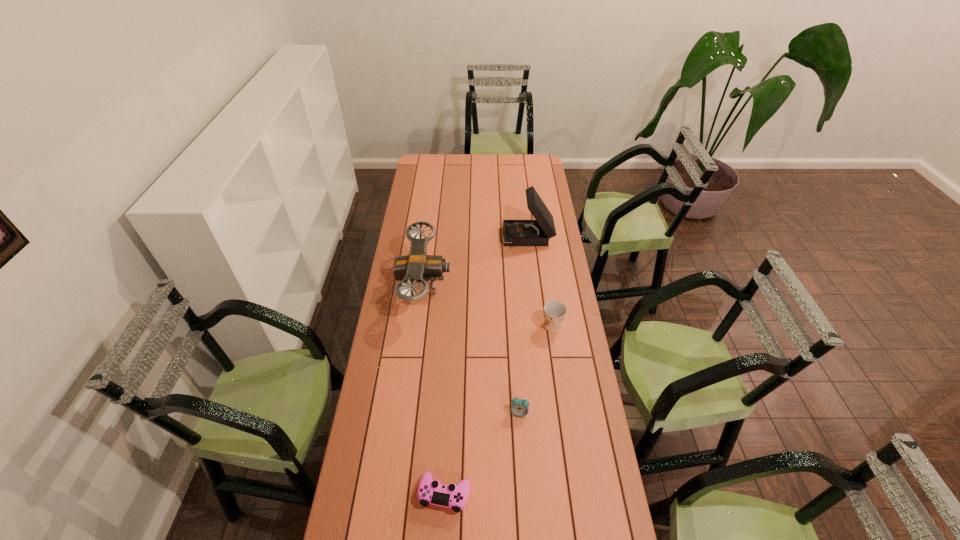
Locate an element on the screen. Image resolution: width=960 pixels, height=540 pixels. the tallest object is located at coordinates (537, 232).

The height and width of the screenshot is (540, 960). Find the location of `drone`. drone is located at coordinates (417, 266).

At what (x,y) coordinates should I click in order to perform the action: click on Dixie cup. Please return your answer as a coordinate pair (x, y). Looking at the image, I should click on (554, 311).

Locate an element on the screen. the fourth farthest object is located at coordinates (519, 407).

Identify the location of alarm clock. (519, 407).

Where is `the nearest object`? The width and height of the screenshot is (960, 540). the nearest object is located at coordinates (430, 491).

Where is `the shortest object`? This screenshot has height=540, width=960. the shortest object is located at coordinates (430, 491).

Where is `free space located on the front-facing side of the tallest object`? The width and height of the screenshot is (960, 540). free space located on the front-facing side of the tallest object is located at coordinates (490, 239).

The height and width of the screenshot is (540, 960). Find the location of `free space located 0.290m on the front-facing side of the tallest object`. free space located 0.290m on the front-facing side of the tallest object is located at coordinates (445, 239).

Where is `free spot located 0.260m on the front-facing side of the tallest object`? This screenshot has height=540, width=960. free spot located 0.260m on the front-facing side of the tallest object is located at coordinates (451, 239).